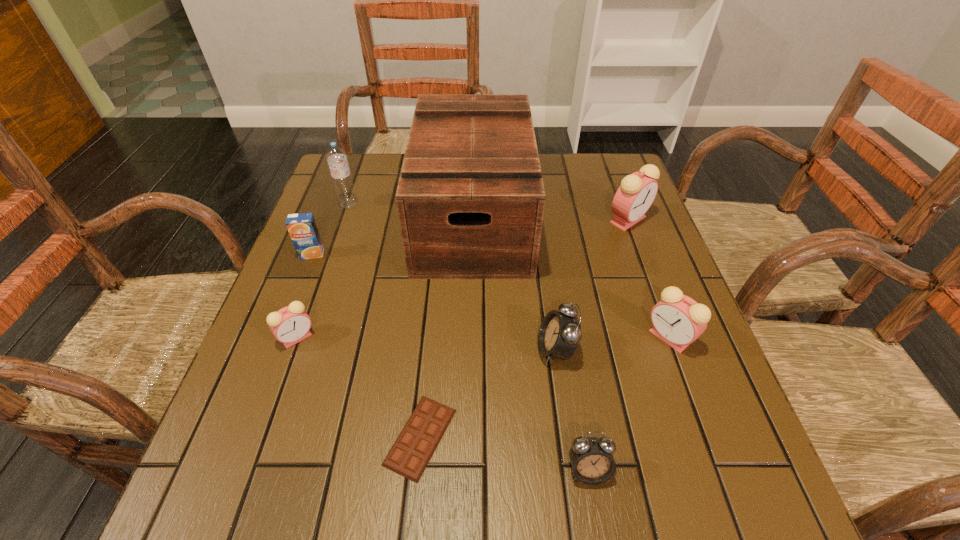
You are a GUI agent. You are given a task and a screenshot of the screen. Output one action in this format:
    pyautogui.click(x=<x>, y=<y>)
    Task: Click on the free space located on the face of the bigger white alarm clock
    The height and width of the screenshot is (540, 960).
    Given the screenshot: What is the action you would take?
    pyautogui.click(x=512, y=350)

Where is `blank space located 0.210m on the back of the blue orange_juice`? This screenshot has width=960, height=540. blank space located 0.210m on the back of the blue orange_juice is located at coordinates (334, 198).

The width and height of the screenshot is (960, 540). Find the location of `free point located on the face of the leftmost pink alarm clock`. free point located on the face of the leftmost pink alarm clock is located at coordinates (281, 382).

The image size is (960, 540). In order to click on vacant space located on the right of the shortest object in this screenshot , I will do `click(549, 437)`.

Where is `box situated at the far edge`? box situated at the far edge is located at coordinates (470, 199).

Locate an element on the screen. The height and width of the screenshot is (540, 960). water bottle that is at the far edge is located at coordinates (337, 160).

At what (x,y) coordinates should I click in order to perform the action: click on alarm clock present at the near edge. Please return your answer as a coordinate pair (x, y). The width and height of the screenshot is (960, 540). Looking at the image, I should click on (592, 461).

Find the location of `chocolate bar positioned at the near edge`. chocolate bar positioned at the near edge is located at coordinates (x=409, y=456).

Identify the location of water bottle positioned at the left edge. click(337, 160).

Where is `orange_juice at the left edge`? The width and height of the screenshot is (960, 540). orange_juice at the left edge is located at coordinates (302, 227).